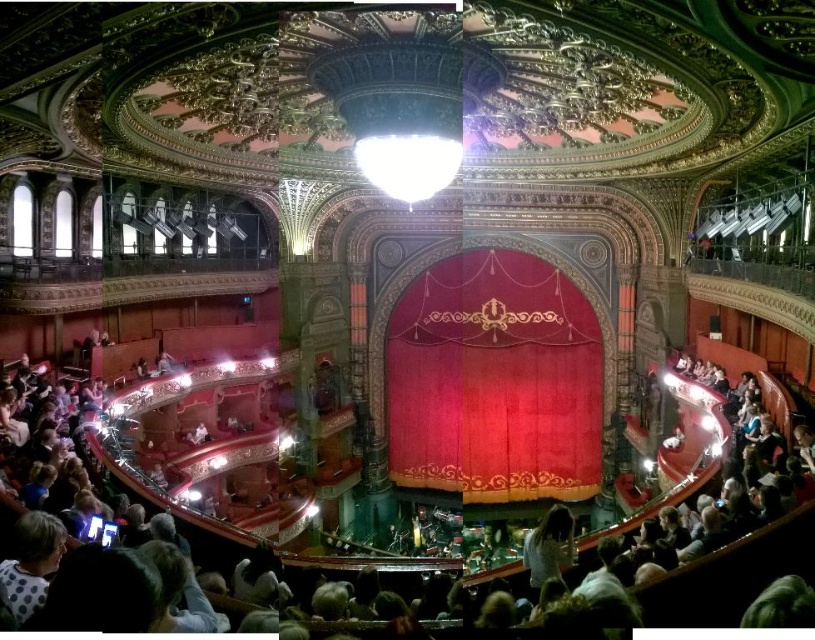
Question: Is velvet/red curtain at center to the left of smooth velvet curtain at center from the viewer's perspective?

Choices:
 (A) yes
 (B) no

Answer: (B)

Question: Which point is farther from the camera taking this photo?

Choices:
 (A) (498, 412)
 (B) (338, 593)

Answer: (A)

Question: Can you confirm if velvet/red curtain at center is thinner than smooth velvet curtain at center?

Choices:
 (A) no
 (B) yes

Answer: (B)

Question: Which point is closer to the camera?

Choices:
 (A) velvet/red curtain at center
 (B) smooth velvet curtain at center

Answer: (B)

Question: Considering the relative positions of velvet/red curtain at center and smooth velvet curtain at center in the image provided, where is velvet/red curtain at center located with respect to smooth velvet curtain at center?

Choices:
 (A) above
 (B) below

Answer: (A)

Question: Which of the following is the closest to the observer?

Choices:
 (A) velvet/red curtain at center
 (B) smooth velvet curtain at center

Answer: (B)